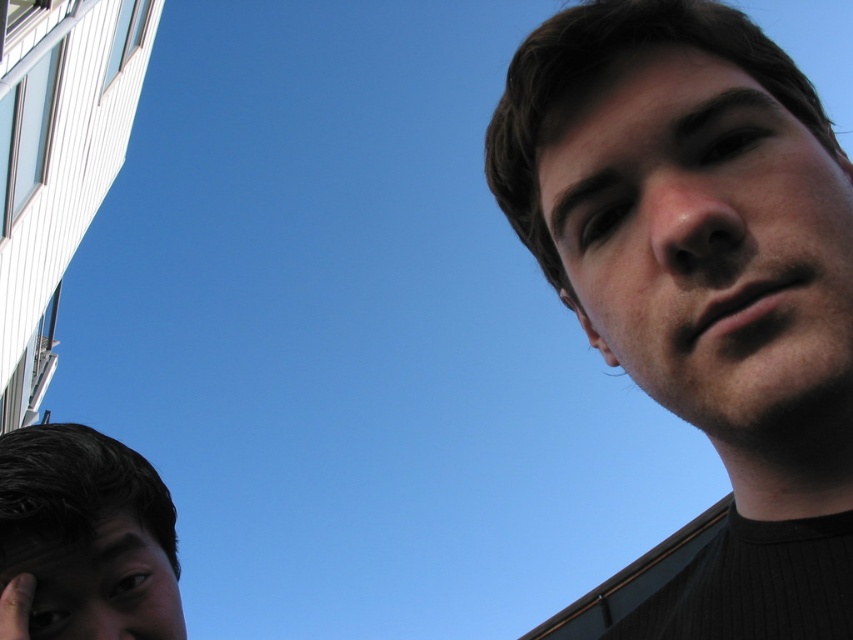
You are a photographer trying to capture a closeup shot of the smooth skin face at lower left and the smooth skin hand at lower left. Since you can only focus on one subject at a time, which one should you choose to ensure it appears in focus if you aim the camera at the center of the face?

The smooth skin face at lower left is located above the smooth skin hand at lower left, so if you aim the camera at the center of the face, the face will be in focus while the hand may be slightly out of focus depending on the depth of field.

You are a photographer adjusting your camera settings to capture the scene. You notice the smooth skin face at lower left and the matte skin ear at upper right. Which object should you focus on if you want to prioritize capturing the wider one?

The matte skin ear at upper right is wider, so you should focus on the matte skin ear at upper right to prioritize capturing the wider one.